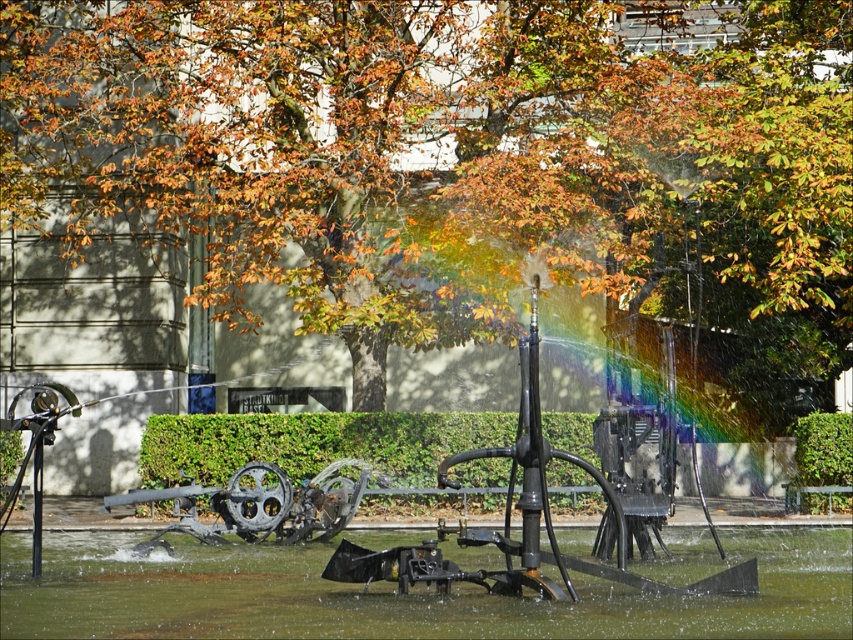
The width and height of the screenshot is (853, 640). What do you see at coordinates (408, 593) in the screenshot?
I see `greenish water at center` at bounding box center [408, 593].

Between point (281, 557) and point (294, 433), which one is positioned in front?

Point (281, 557) is in front.

Find the location of a particular element. greenish water at center is located at coordinates (408, 593).

Does autumn leaves at center have a larger size compared to greenish water at center?

Correct, autumn leaves at center is larger in size than greenish water at center.

What are the coordinates of `autumn leaves at center` in the screenshot? It's located at (451, 156).

Can you confirm if autumn leaves at center is positioned below green leafy hedge at center?

No.

Is point (360, 129) positioned before point (802, 426)?

Yes, point (360, 129) is closer to viewer.

This screenshot has height=640, width=853. Find the location of `autumn leaves at center`. autumn leaves at center is located at coordinates coord(451,156).